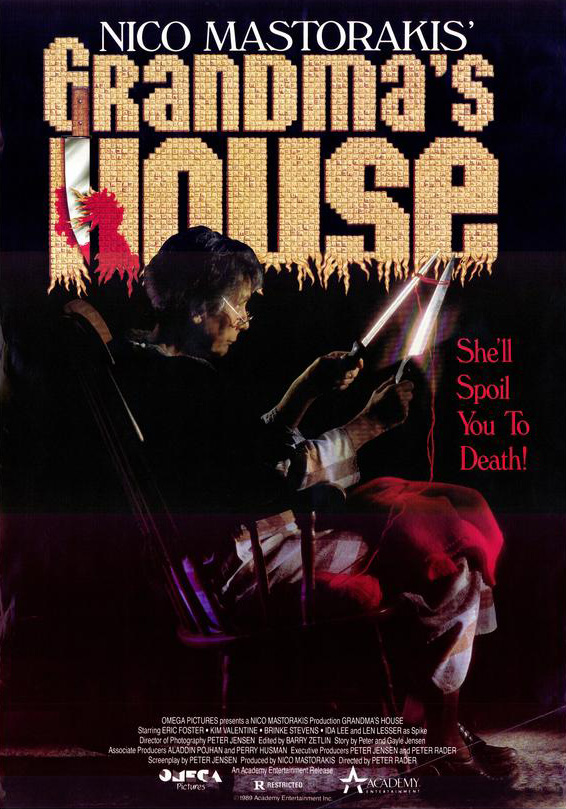
I want to click on blanket, so click(x=456, y=518).